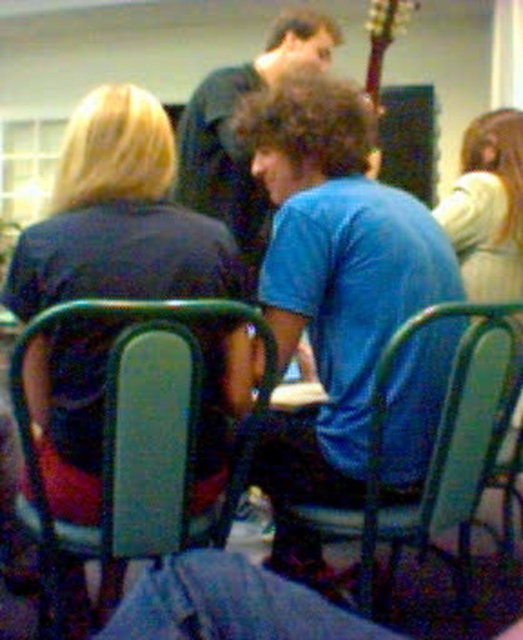
You are a person who is 1.7 meters tall and standing at the camera position. There is a green plastic chair at center that you want to sit on. Can you reach it without moving your feet?

The green plastic chair at center is 1.33 meters away from the camera, so yes, you can reach it without moving your feet since it is within your arm reach.

You are at a social gathering and want to get the attention of the person wearing the blue cotton shirt at center. Since they are currently facing away from you, you decide to approach them by moving around the wooden acoustic guitar at upper right. Based on their positions, will you need to go around the guitar to your left or right side?

The blue cotton shirt at center is positioned under the wooden acoustic guitar at upper right, so you would need to go around the guitar to your left side to approach the person.

You are at a social gathering and want to grab the wooden acoustic guitar at upper right. There is a blue cotton shirt at center in your way. Which object should you move first to reach the guitar?

The blue cotton shirt at center is to the left of the wooden acoustic guitar at upper right, so you should move the blue cotton shirt at center first to reach the guitar.